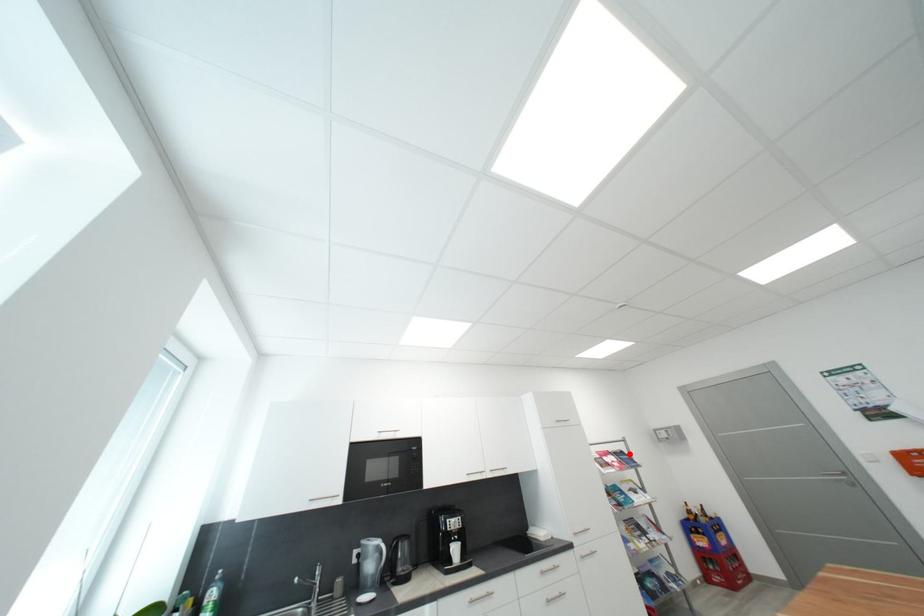
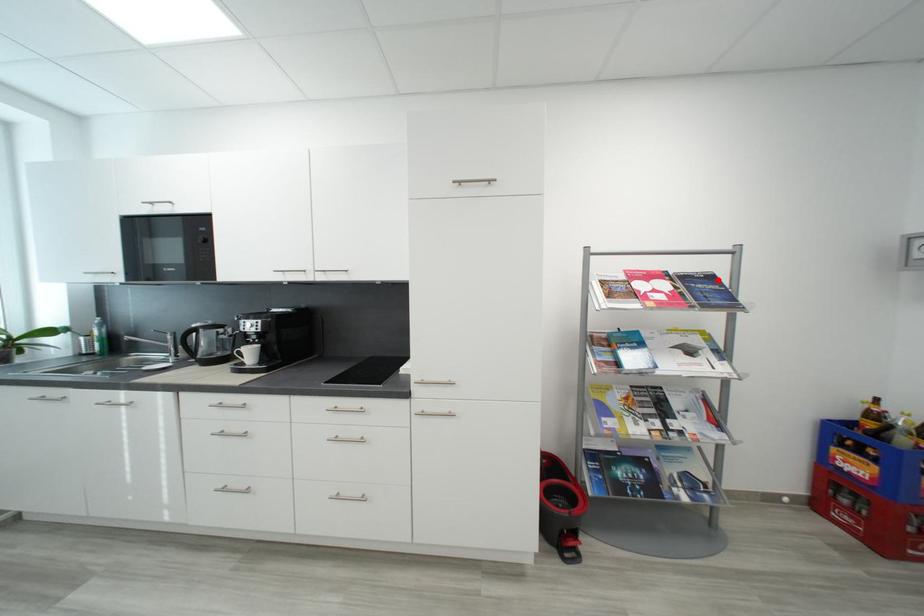
I am providing you with two images of the same scene from different viewpoints. A red point is marked on the first image and another point is marked on the second image. Is the marked point in image1 the same physical position as the marked point in image2?

Yes